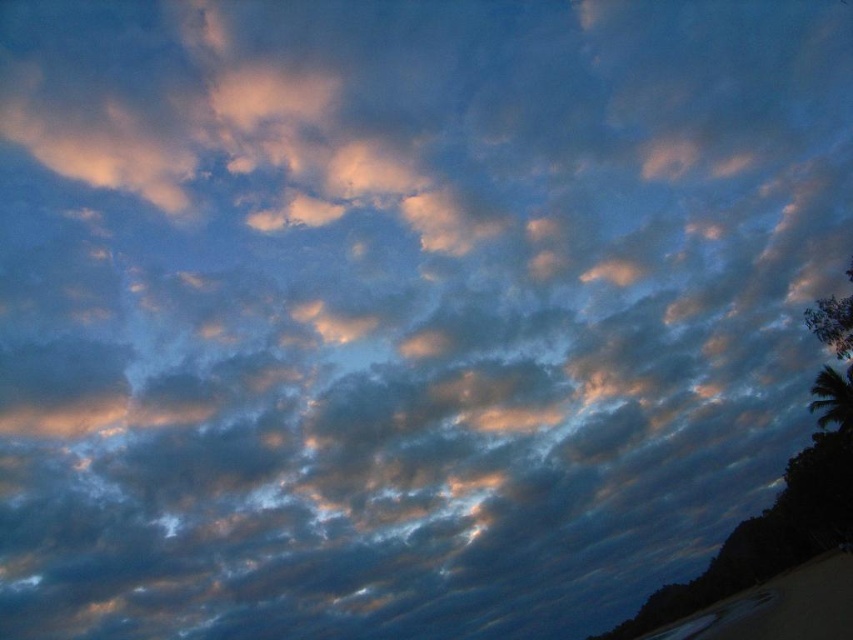
Based on the photo, is sandy beach at lower right positioned behind green leafy palm tree at lower right?

No, it is in front of green leafy palm tree at lower right.

In the scene shown: Is sandy beach at lower right taller than green leafy palm tree at lower right?

Correct, sandy beach at lower right is much taller as green leafy palm tree at lower right.

Is point (786, 614) behind point (833, 392)?

No, (786, 614) is in front of (833, 392).

What are the coordinates of `sandy beach at lower right` in the screenshot? It's located at (782, 605).